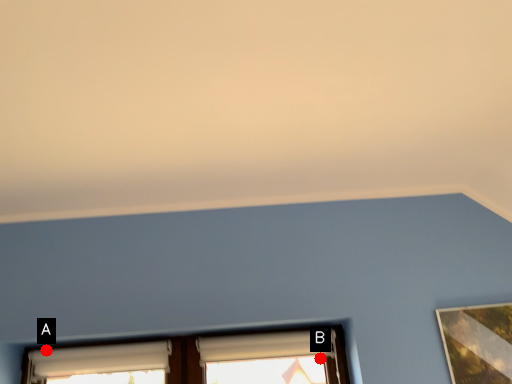
Question: Two points are circled on the image, labeled by A and B beside each circle. Which of the following is the closest to the observer?

Choices:
 (A) A is closer
 (B) B is closer

Answer: (A)